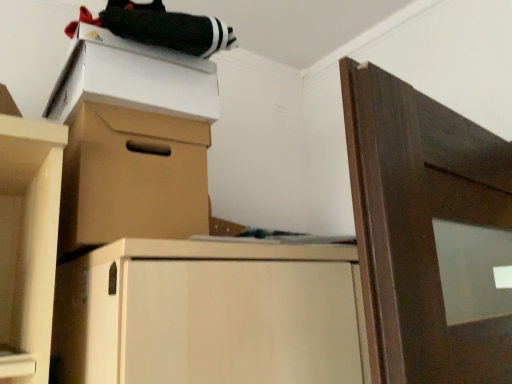
Question: Do you think brown cardboard box at upper center is within white cardboard box at upper left, or outside of it?

Choices:
 (A) outside
 (B) inside

Answer: (A)

Question: Is point (81, 220) positioned closer to the camera than point (185, 117)?

Choices:
 (A) closer
 (B) farther

Answer: (A)

Question: From the image's perspective, is brown cardboard box at upper center above or below white cardboard box at upper left?

Choices:
 (A) below
 (B) above

Answer: (A)

Question: Is white cardboard box at upper left taller or shorter than brown cardboard box at upper center?

Choices:
 (A) short
 (B) tall

Answer: (A)

Question: Based on their sizes in the image, would you say white cardboard box at upper left is bigger or smaller than brown cardboard box at upper center?

Choices:
 (A) big
 (B) small

Answer: (B)

Question: Visually, is white cardboard box at upper left positioned to the left or to the right of brown cardboard box at upper center?

Choices:
 (A) right
 (B) left

Answer: (B)

Question: Do you think white cardboard box at upper left is within brown cardboard box at upper center, or outside of it?

Choices:
 (A) inside
 (B) outside

Answer: (B)